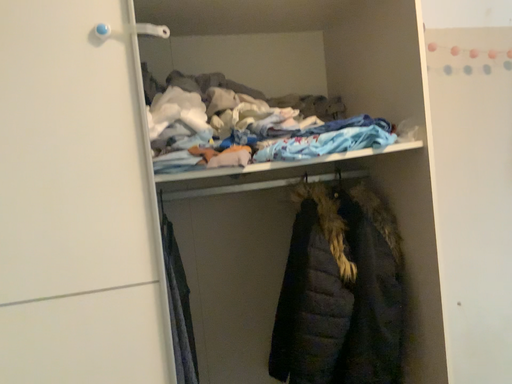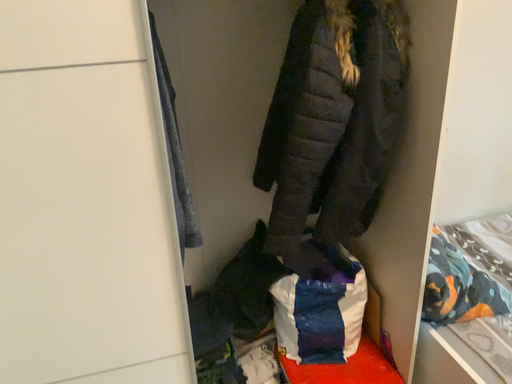
Question: Which way did the camera rotate in the video?

Choices:
 (A) rotated upward
 (B) rotated downward

Answer: (B)